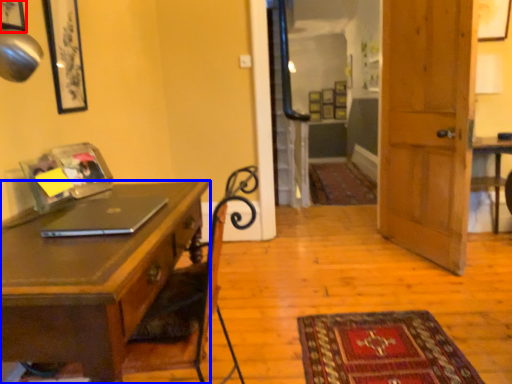
Question: Which of the following is the farthest to the observer, picture frame (highlighted by a red box) or desk (highlighted by a blue box)?

Choices:
 (A) picture frame
 (B) desk

Answer: (A)